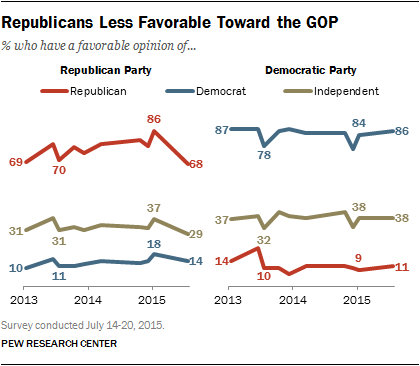
At what (x,y) coordinates should I click in order to perform the action: click on speaker. Please return your answer as a coordinate pair (x, y). This screenshot has height=366, width=420. Looking at the image, I should click on (300, 238).